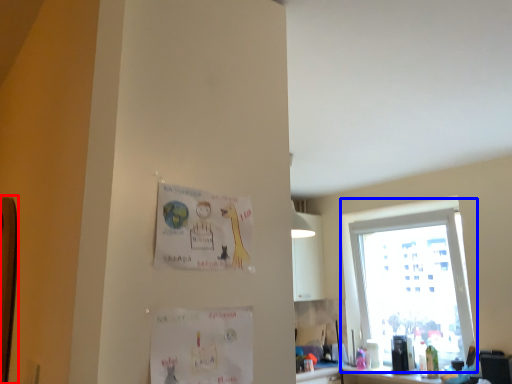
Question: Which object is closer to the camera taking this photo, bulletin board (highlighted by a red box) or window (highlighted by a blue box)?

Choices:
 (A) bulletin board
 (B) window

Answer: (A)